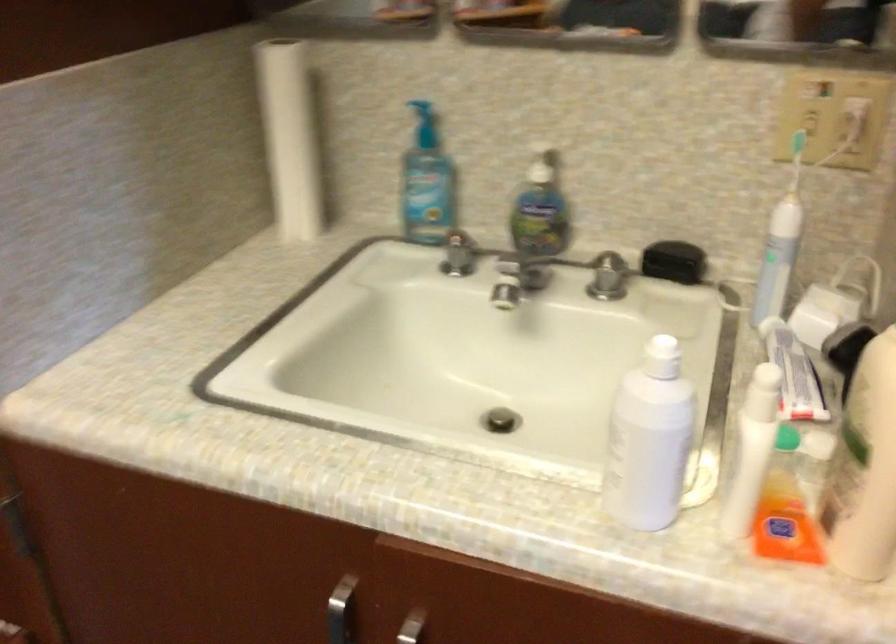
Identify the location of paper towel roll. [289, 138].